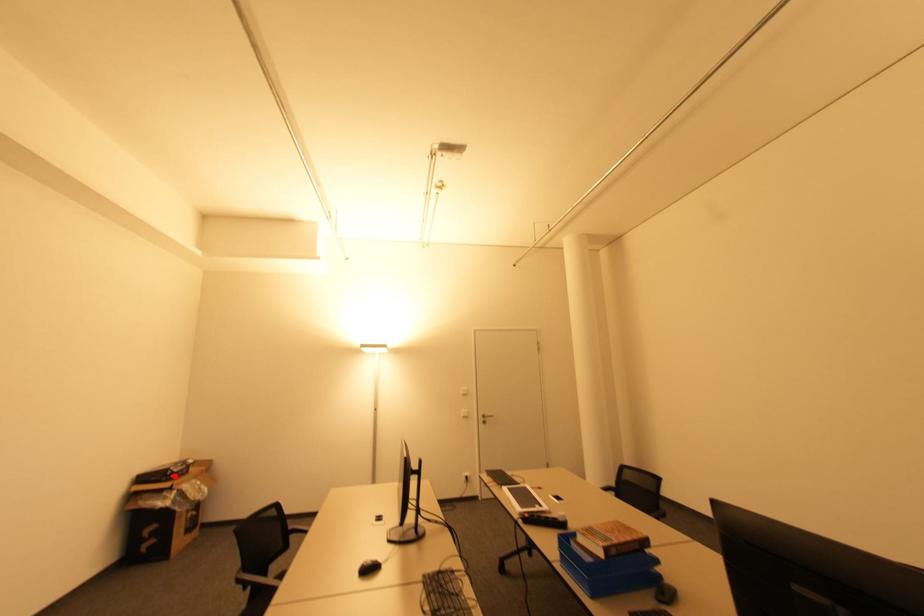
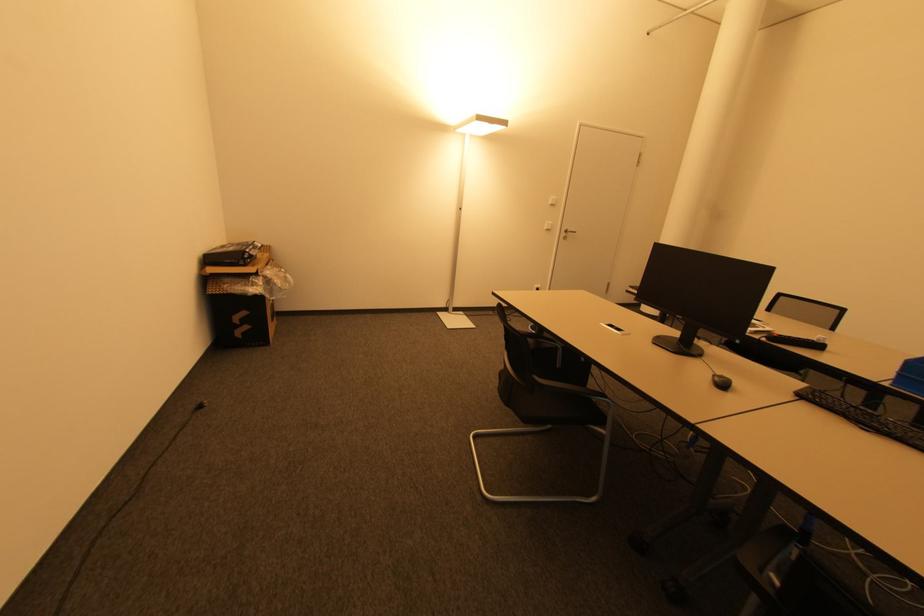
Locate, in the second image, the point that corresponds to the highlighted location in the first image.

(250, 261)